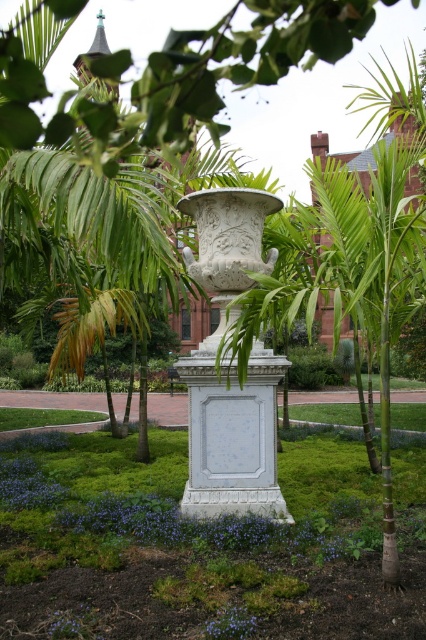
Question: In this image, where is purple matte flower at lower left located relative to purple matte flower at center?

Choices:
 (A) left
 (B) right

Answer: (A)

Question: Observing the image, what is the correct spatial positioning of purple matte flower at lower left in reference to purple matte flower at center?

Choices:
 (A) above
 (B) below

Answer: (B)

Question: Which point appears closest to the camera in this image?

Choices:
 (A) (81, 614)
 (B) (242, 636)

Answer: (B)

Question: Is purple matte flower at lower left positioned behind purple matte flower at center?

Choices:
 (A) yes
 (B) no

Answer: (B)

Question: Which of the following is the closest to the observer?

Choices:
 (A) purple matte flower at center
 (B) purple matte flower at lower left

Answer: (B)